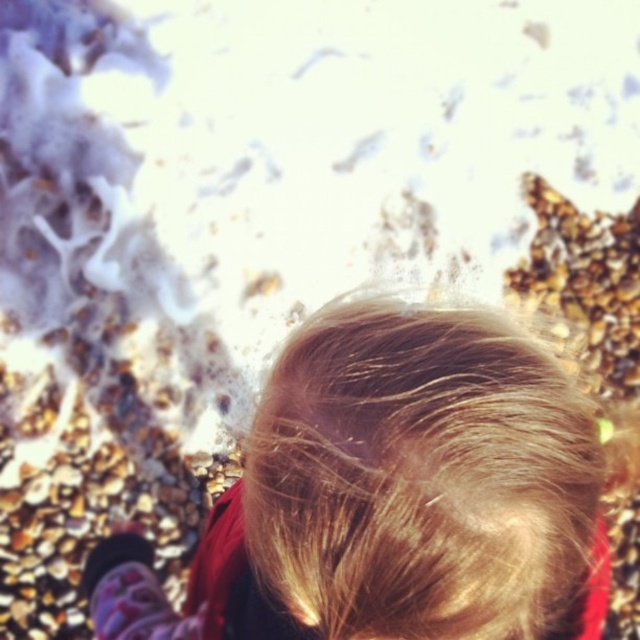
You are a photographer trying to capture a close shot of the person. You need to focus on the hair that is bigger. Which one should you choose between the blonde hair at center and the blonde silky hair at center?

The blonde hair at center is larger in size than the blonde silky hair at center, so you should focus on the blonde hair at center.

You are a photographer setting up a shoot near the coast. You notice two strands of hair in the frame at the center of the image, one labeled as blonde hair at center and the other as blonde silky hair at center. Which strand appears taller in the image?

The blonde hair at center appears taller than the blonde silky hair at center in the image.

You are a photographer trying to capture the texture of the hair in the image. You notice two distinct sections of hair labeled as blonde hair at center and blonde silky hair at center. Which section is positioned lower in the frame?

The blonde hair at center is positioned lower than the blonde silky hair at center in the frame.